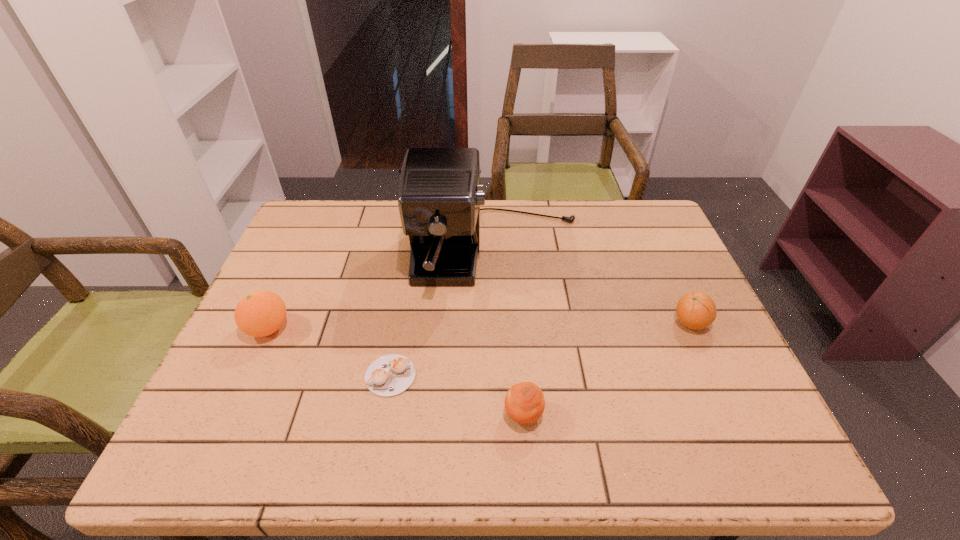
Locate an element on the screen. coffee maker is located at coordinates (440, 194).

Find the location of a particular element. the tallest object is located at coordinates (440, 194).

What are the coordinates of `the tallest orange` in the screenshot? It's located at [261, 313].

Where is `the leftmost object`? This screenshot has width=960, height=540. the leftmost object is located at coordinates (261, 313).

Locate an element on the screen. This screenshot has width=960, height=540. the rightmost object is located at coordinates (696, 310).

Find the location of a particular element. the nearest orange is located at coordinates (524, 402).

The height and width of the screenshot is (540, 960). What are the coordinates of `cappuccino` in the screenshot? It's located at (389, 375).

Where is `free point located on the front-facing side of the tallest object`? free point located on the front-facing side of the tallest object is located at coordinates (499, 321).

Where is `blank space located on the right of the second tallest object`? blank space located on the right of the second tallest object is located at coordinates (420, 328).

I want to click on vacant space located 0.230m on the back of the rightmost object, so click(x=658, y=251).